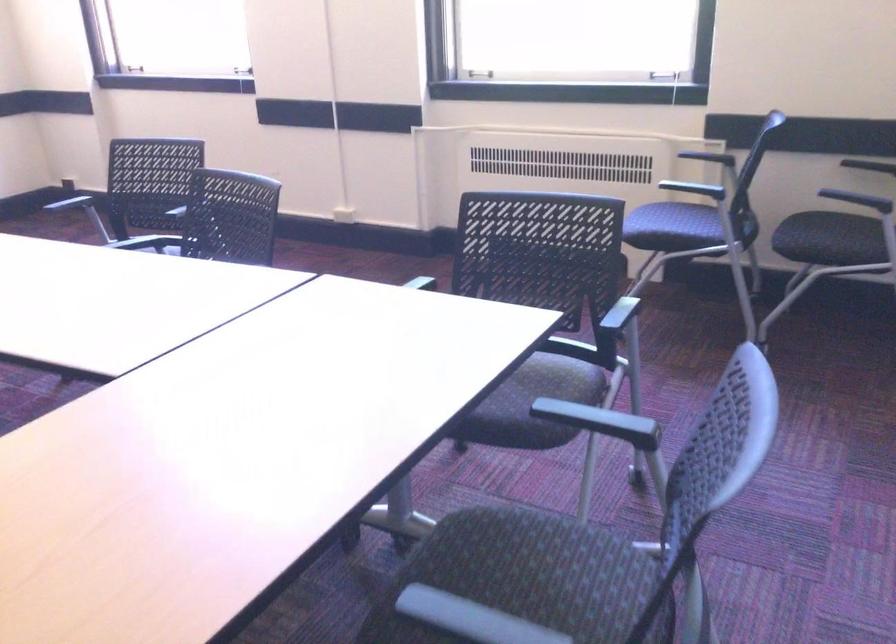
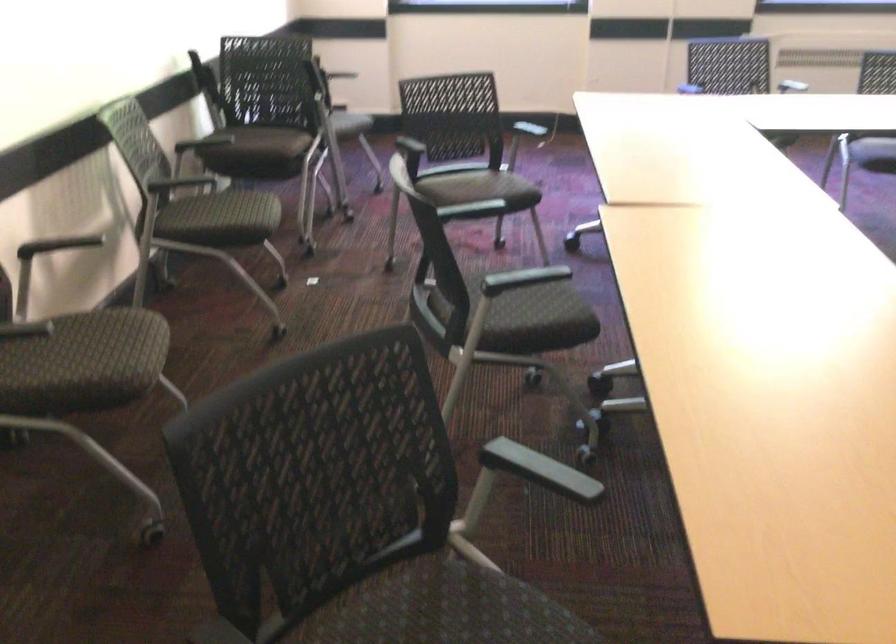
Question: Which direction would the cameraman need to move to produce the second image? Reply with the corresponding letter.

Choices:
 (A) Left
 (B) Right
 (C) Forward
 (D) Backward

Answer: (A)